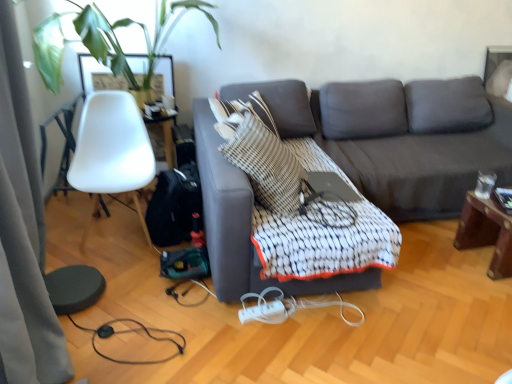
The image size is (512, 384). I want to click on free space on the front side of white plastic cable at lower center, positioned as the first cable in right-to-left order, so click(x=298, y=357).